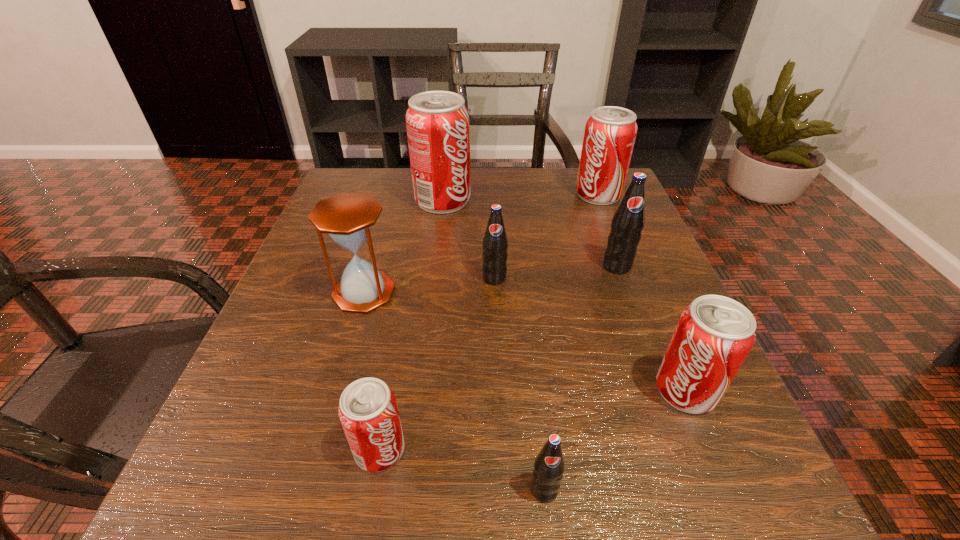
Select which red soda can is the second closest to the sixth farthest object. Please provide its 2D coordinates. Your answer should be formatted as a tuple, i.e. [(x, y)], where the tuple contains the x and y coordinates of a point satisfying the conditions above.

[(610, 132)]

What are the coordinates of `red soda can that is the second closest to the nearest red soda can` in the screenshot? It's located at (437, 122).

You are a GUI agent. You are given a task and a screenshot of the screen. Output one action in this format:
    pyautogui.click(x=<x>, y=<y>)
    Task: Click on the black pop that is the third closest to the second biggest red soda can
    The height and width of the screenshot is (540, 960).
    Given the screenshot: What is the action you would take?
    pyautogui.click(x=549, y=466)

Find the location of a particular element. black pop that is the second closest to the tallest pop is located at coordinates (628, 221).

What are the coordinates of `free space that satisfies the following two spatial constraints: 1. on the front label of the biggest black pop; 2. on the left side of the third farthest red soda can` in the screenshot? It's located at (662, 390).